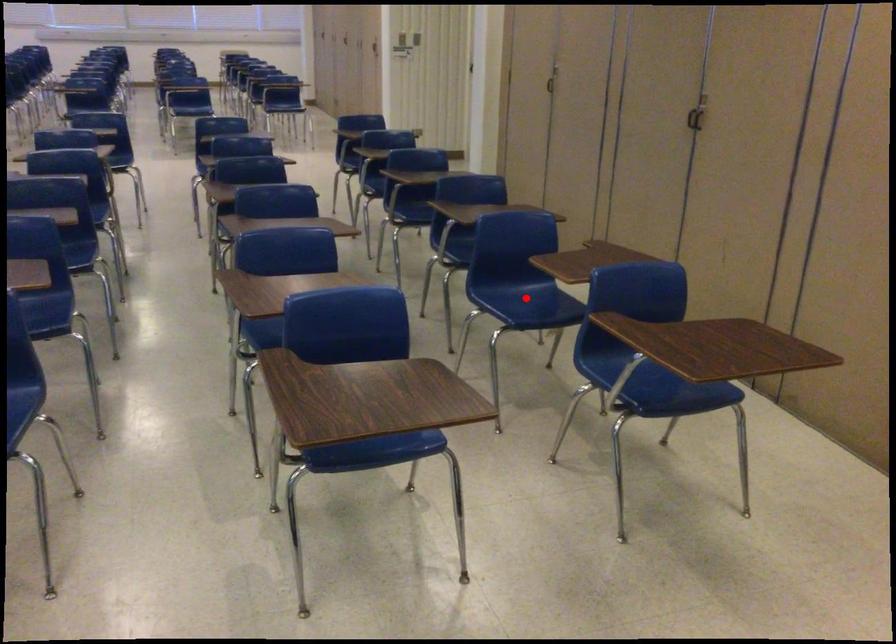
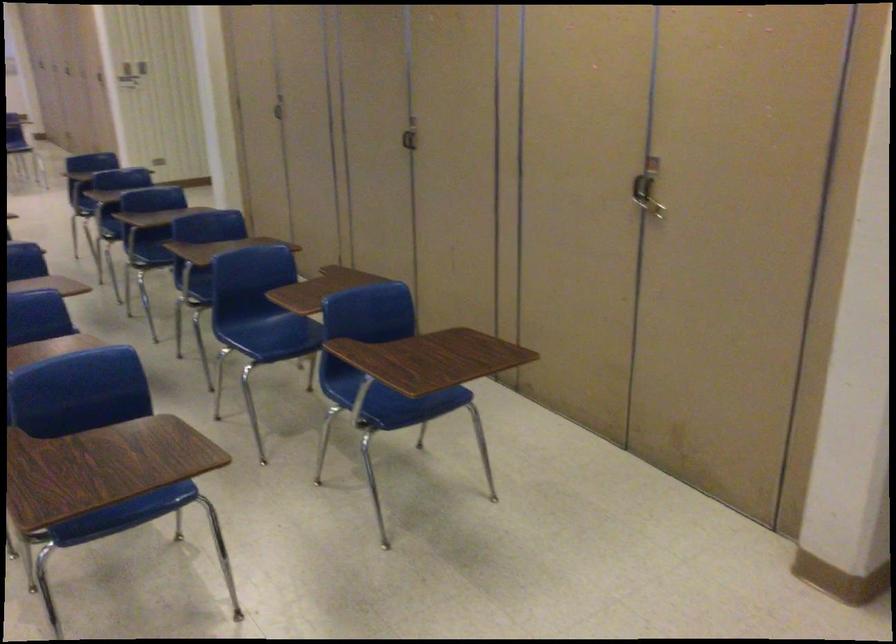
Question: I am providing you with two images of the same scene from different viewpoints. A red point is marked on the first image. Can you still see the location of the red point in image 2?

Choices:
 (A) Yes
 (B) No

Answer: (A)